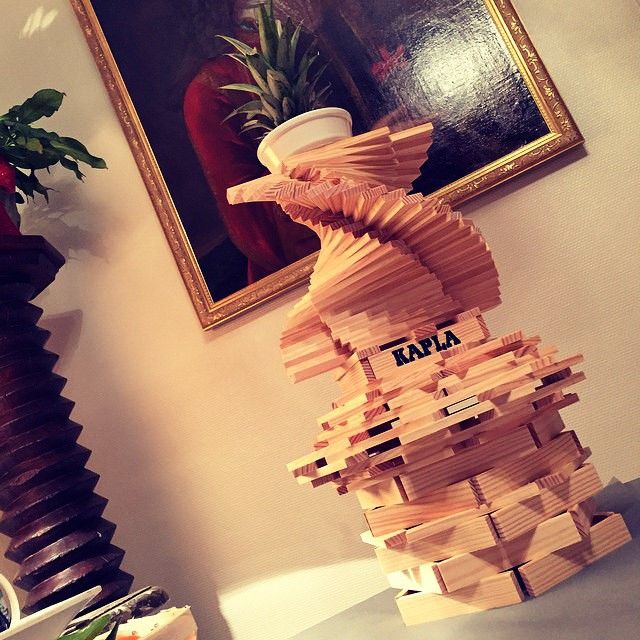
You are a GUI agent. You are given a task and a screenshot of the screen. Output one action in this format:
    pyautogui.click(x=<x>, y=<y>)
    Task: Click on the white plastic pot
    
    Given the screenshot: What is the action you would take?
    pyautogui.click(x=296, y=129)